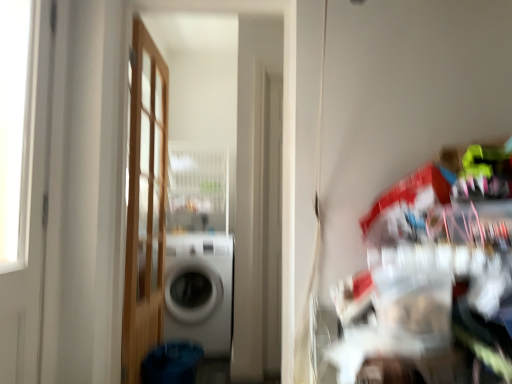
Question: Is white glossy washing machine at center at the back of white glossy door at left, marked as the first door in a front-to-back arrangement?

Choices:
 (A) yes
 (B) no

Answer: (B)

Question: Is white glossy door at left, placed as the second door when sorted from right to left, closer to the viewer compared to white glossy washing machine at center?

Choices:
 (A) no
 (B) yes

Answer: (B)

Question: Is white glossy door at left, placed as the second door when sorted from right to left, to the right of white glossy washing machine at center from the viewer's perspective?

Choices:
 (A) no
 (B) yes

Answer: (A)

Question: Can you confirm if white glossy door at left, marked as the first door in a front-to-back arrangement, is taller than white glossy washing machine at center?

Choices:
 (A) yes
 (B) no

Answer: (A)

Question: Are white glossy door at left, which is the first door from left to right, and white glossy washing machine at center located far from each other?

Choices:
 (A) no
 (B) yes

Answer: (B)

Question: Is white glossy door at left, which is the first door from left to right, in front of or behind wooden door at left, the 1th door from the right, in the image?

Choices:
 (A) front
 (B) behind

Answer: (A)

Question: Would you say white glossy door at left, which is the first door from left to right, is inside or outside wooden door at left, which ranks as the 2th door in left-to-right order?

Choices:
 (A) outside
 (B) inside

Answer: (A)

Question: Is point (40, 297) positioned closer to the camera than point (162, 175)?

Choices:
 (A) farther
 (B) closer

Answer: (B)

Question: Based on their positions, is white glossy door at left, which is the first door from left to right, located to the left or right of wooden door at left, which is the first door from back to front?

Choices:
 (A) left
 (B) right

Answer: (A)

Question: From their relative heights in the image, would you say white glossy washing machine at center is taller or shorter than wooden door at left, which is the first door from back to front?

Choices:
 (A) tall
 (B) short

Answer: (B)

Question: Looking at the image, does white glossy washing machine at center seem bigger or smaller compared to wooden door at left, which ranks as the 2th door in left-to-right order?

Choices:
 (A) small
 (B) big

Answer: (B)

Question: From the image's perspective, relative to wooden door at left, marked as the 2th door in a front-to-back arrangement, is white glossy washing machine at center above or below?

Choices:
 (A) above
 (B) below

Answer: (B)

Question: Considering the relative positions of white glossy washing machine at center and wooden door at left, which is the first door from back to front, in the image provided, is white glossy washing machine at center to the left or to the right of wooden door at left, which is the first door from back to front,?

Choices:
 (A) left
 (B) right

Answer: (B)

Question: In the image, is wooden door at left, the 1th door from the right, positioned in front of or behind white glossy washing machine at center?

Choices:
 (A) front
 (B) behind

Answer: (A)

Question: Considering the relative positions of wooden door at left, the 1th door from the right, and white glossy washing machine at center in the image provided, is wooden door at left, the 1th door from the right, to the left or to the right of white glossy washing machine at center?

Choices:
 (A) left
 (B) right

Answer: (A)